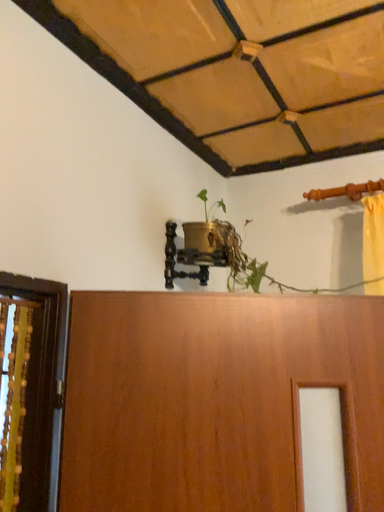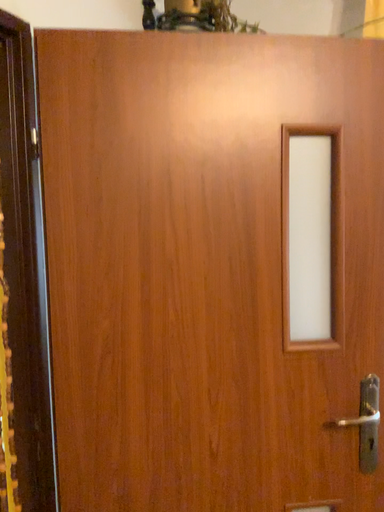
Question: How did the camera likely rotate when shooting the video?

Choices:
 (A) rotated upward
 (B) rotated downward

Answer: (B)